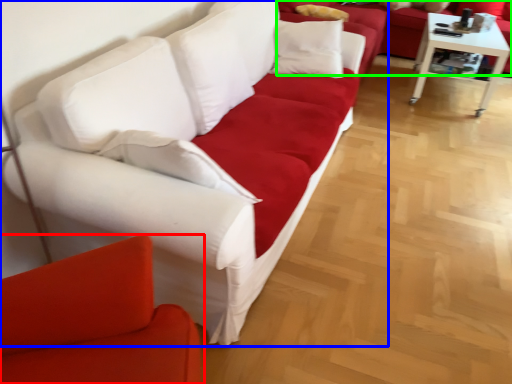
Question: Which object is positioned closest to studio couch (highlighted by a red box)? Select from studio couch (highlighted by a blue box) and studio couch (highlighted by a green box).

Choices:
 (A) studio couch
 (B) studio couch

Answer: (A)